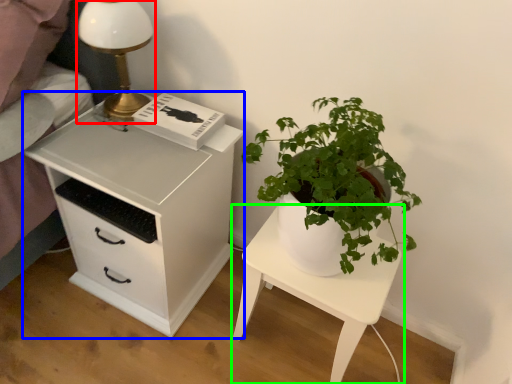
Question: Which is nearer to the table lamp (highlighted by a red box)? chest of drawers (highlighted by a blue box) or nightstand (highlighted by a green box).

Choices:
 (A) chest of drawers
 (B) nightstand

Answer: (A)